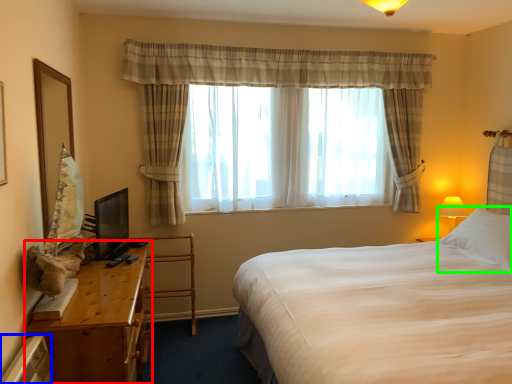
Question: Which is nearer to the table (highlighted by a red box)? radiator (highlighted by a blue box) or pillow (highlighted by a green box).

Choices:
 (A) radiator
 (B) pillow

Answer: (A)